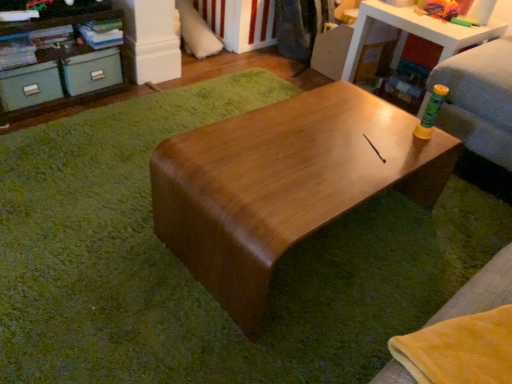
Question: From the image's perspective, would you say matte green drawer at left, the 2th drawer in the left-to-right sequence, is shown under matte teal storage boxes at upper left?

Choices:
 (A) yes
 (B) no

Answer: (A)

Question: Could you tell me if matte green drawer at left, the 2th drawer in the left-to-right sequence, is turned towards matte teal storage boxes at upper left?

Choices:
 (A) yes
 (B) no

Answer: (A)

Question: Does matte green drawer at left, the 1th drawer from the right, come in front of matte teal storage boxes at upper left?

Choices:
 (A) no
 (B) yes

Answer: (A)

Question: From the image's perspective, is matte green drawer at left, the 1th drawer from the right, above matte teal storage boxes at upper left?

Choices:
 (A) no
 (B) yes

Answer: (A)

Question: Does matte green drawer at left, the 1th drawer from the right, have a greater width compared to matte teal storage boxes at upper left?

Choices:
 (A) yes
 (B) no

Answer: (B)

Question: Is matte green drawer at left, the 2th drawer in the left-to-right sequence, oriented away from matte teal storage boxes at upper left?

Choices:
 (A) yes
 (B) no

Answer: (A)

Question: Considering the relative sizes of matte green drawer at left, acting as the 2th drawer starting from the right, and shiny brown table at upper right, the second table positioned from the bottom, in the image provided, is matte green drawer at left, acting as the 2th drawer starting from the right, taller than shiny brown table at upper right, the second table positioned from the bottom,?

Choices:
 (A) no
 (B) yes

Answer: (A)

Question: Is matte green drawer at left, acting as the 2th drawer starting from the right, thinner than shiny brown table at upper right, which appears as the second table when viewed from the front?

Choices:
 (A) yes
 (B) no

Answer: (A)

Question: Is matte green drawer at left, acting as the 2th drawer starting from the right, bigger than shiny brown table at upper right, which appears as the second table when viewed from the front?

Choices:
 (A) yes
 (B) no

Answer: (B)

Question: From a real-world perspective, is matte green drawer at left, acting as the 2th drawer starting from the right, located beneath shiny brown table at upper right, the second table positioned from the bottom?

Choices:
 (A) no
 (B) yes

Answer: (B)

Question: Could you tell me if matte green drawer at left, acting as the 2th drawer starting from the right, is facing shiny brown table at upper right, positioned as the 1th table in top-to-bottom order?

Choices:
 (A) yes
 (B) no

Answer: (B)

Question: Does matte green drawer at left, the first drawer positioned from the left, lie behind shiny brown table at upper right, marked as the 1th table in a right-to-left arrangement?

Choices:
 (A) yes
 (B) no

Answer: (B)

Question: Is matte green drawer at left, the 2th drawer in the left-to-right sequence, outside shiny brown table at upper right, which appears as the second table when viewed from the front?

Choices:
 (A) no
 (B) yes

Answer: (B)